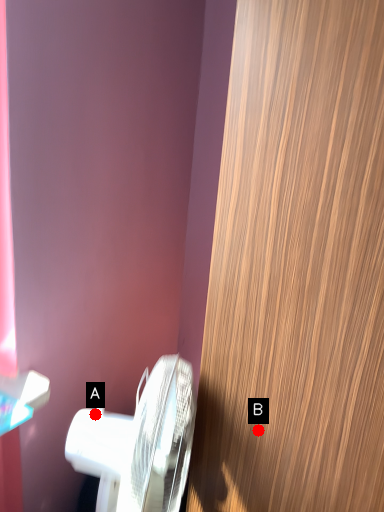
Question: Two points are circled on the image, labeled by A and B beside each circle. Among these points, which one is farthest from the camera?

Choices:
 (A) A is further
 (B) B is further

Answer: (A)